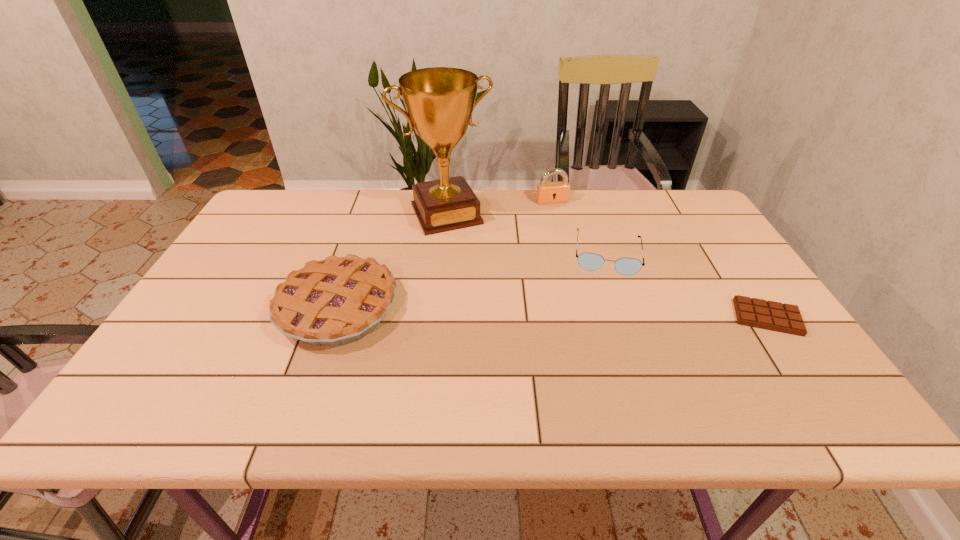
This screenshot has width=960, height=540. In order to click on pie in this screenshot , I will do `click(339, 300)`.

The image size is (960, 540). Find the location of `the rightmost object`. the rightmost object is located at coordinates (786, 318).

Find the location of a particular element. candy bar is located at coordinates (786, 318).

The width and height of the screenshot is (960, 540). I want to click on padlock, so (x=547, y=192).

The width and height of the screenshot is (960, 540). In order to click on spectacles in this screenshot , I will do `click(589, 261)`.

Find the location of `award`. award is located at coordinates (439, 101).

The width and height of the screenshot is (960, 540). Identify the location of vacant area located on the back of the pie. (370, 215).

The height and width of the screenshot is (540, 960). I want to click on vacant space located on the back of the shortest object, so click(x=738, y=274).

Locate an element on the screen. vacant point located to unlock the padlock from the front is located at coordinates (594, 284).

The image size is (960, 540). I want to click on vacant space located to unlock the padlock from the front, so click(x=577, y=250).